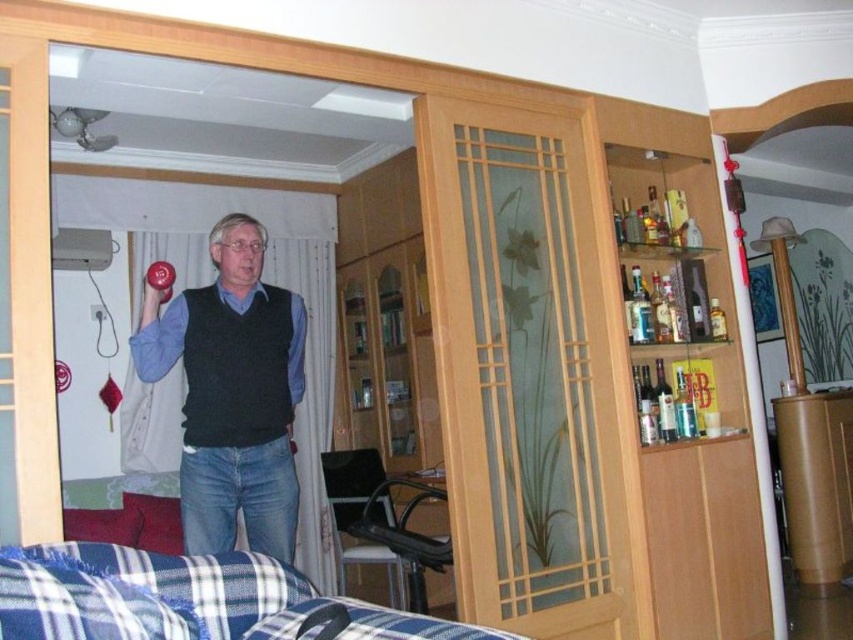
Image resolution: width=853 pixels, height=640 pixels. What do you see at coordinates (525, 374) in the screenshot? I see `transparent glass door at center` at bounding box center [525, 374].

Between point (469, 202) and point (236, 371), which one is positioned in front?

Point (236, 371) is more forward.

I want to click on transparent glass door at center, so click(x=525, y=374).

Does matte black vest at center have a smaller size compared to blue plaid fabric at lower left?

No.

Can you confirm if matte black vest at center is positioned to the left of blue plaid fabric at lower left?

Correct, you'll find matte black vest at center to the left of blue plaid fabric at lower left.

The height and width of the screenshot is (640, 853). In order to click on matte black vest at center in this screenshot , I will do `click(231, 394)`.

Where is `matte black vest at center`? matte black vest at center is located at coordinates (231, 394).

The width and height of the screenshot is (853, 640). Identify the location of transparent glass door at center. (525, 374).